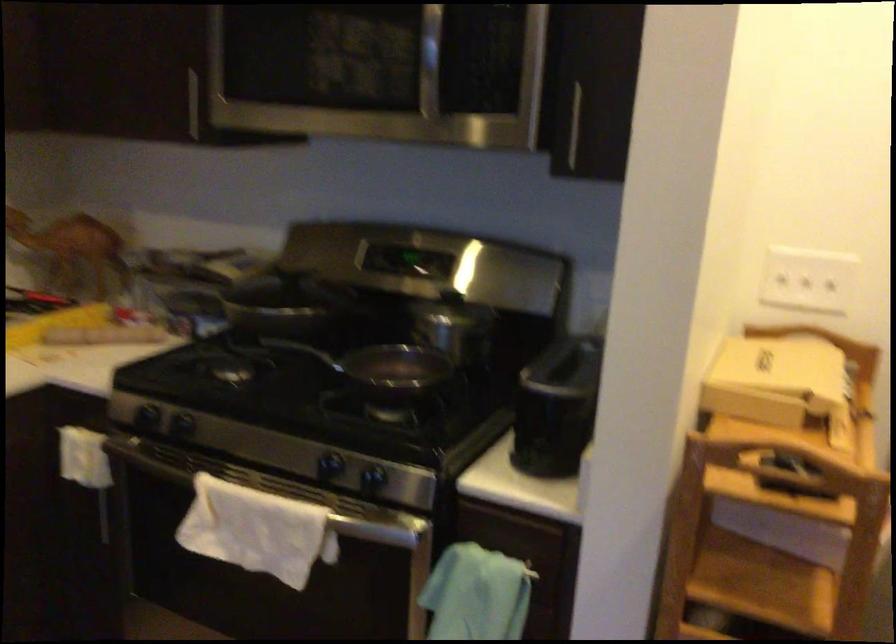
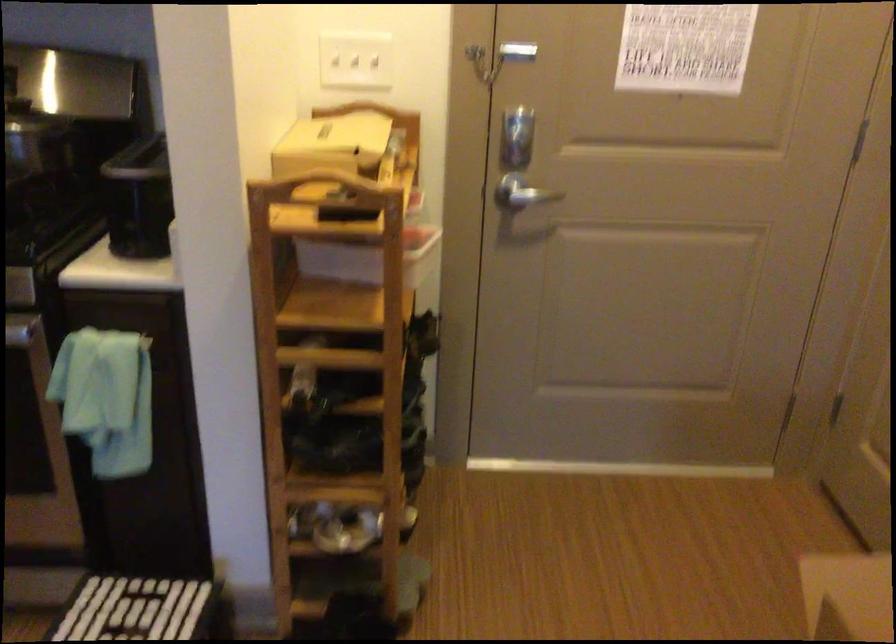
Question: The camera is either moving clockwise (left) or counter-clockwise (right) around the object. The first image is from the beginning of the video and the second image is from the end. Is the camera moving left or right when shooting the video?

Choices:
 (A) Left
 (B) Right

Answer: (A)